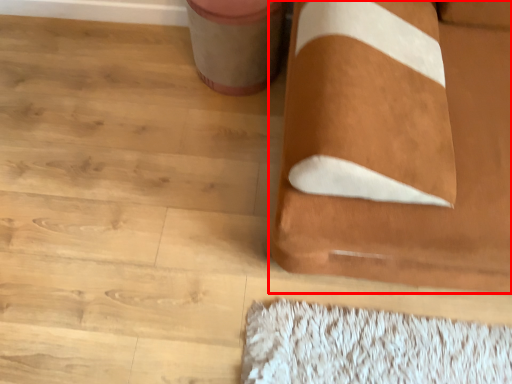
Question: Where is furniture (annotated by the red box) located in relation to potty in the image?

Choices:
 (A) right
 (B) left

Answer: (A)